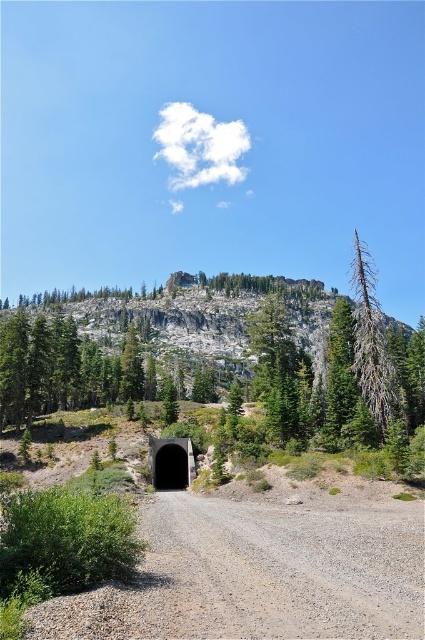
You are a hiker who wants to take a photo of the gray rocky mountain at upper center and the black concrete tunnel at center. Which object should you focus on first if you want to capture both in a single frame without moving the camera?

You should focus on the gray rocky mountain at upper center first because it is taller than the black concrete tunnel at center, so adjusting focus to the distant mountain ensures both are in the frame.

You are standing at the tunnel entrance and want to reach a specific location marked by point coordinates. Which point, point (360, 632) or point (306, 305), is closer to you?

Point (360, 632) is closer to the viewer than point (306, 305), so you should head towards point (360, 632) first.

Based on the photo, you are standing at the entrance of the tunnel in the image. You want to walk to the gray gravel road at lower center. Which direction should you go relative to your current position?

The gray gravel road at lower center is located at point [258,573] in the image. Since you are at the tunnel entrance in the foreground, which is likely near the bottom of the image, the road is positioned slightly to the right and above your current position. Therefore, you should walk towards the upper right direction to reach the gray gravel road at lower center.